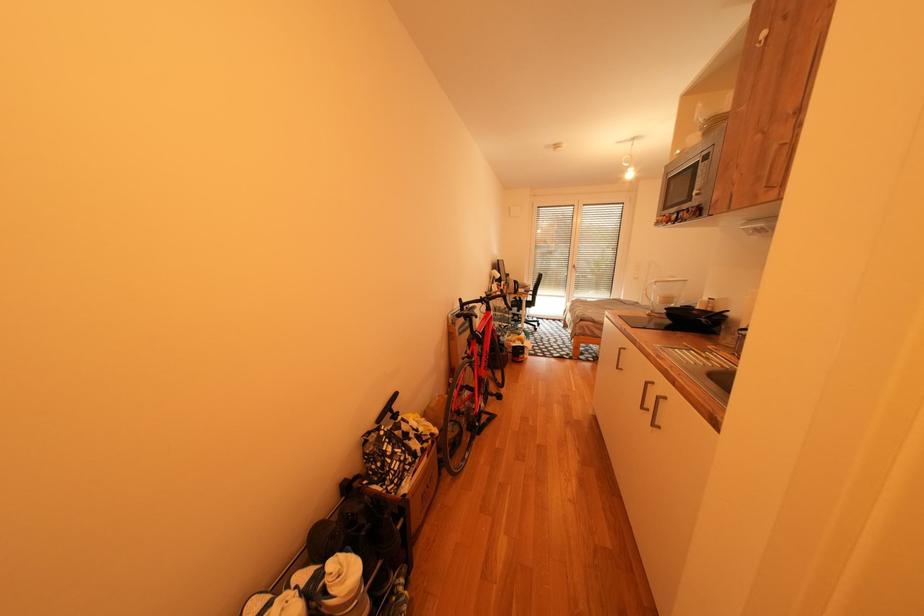
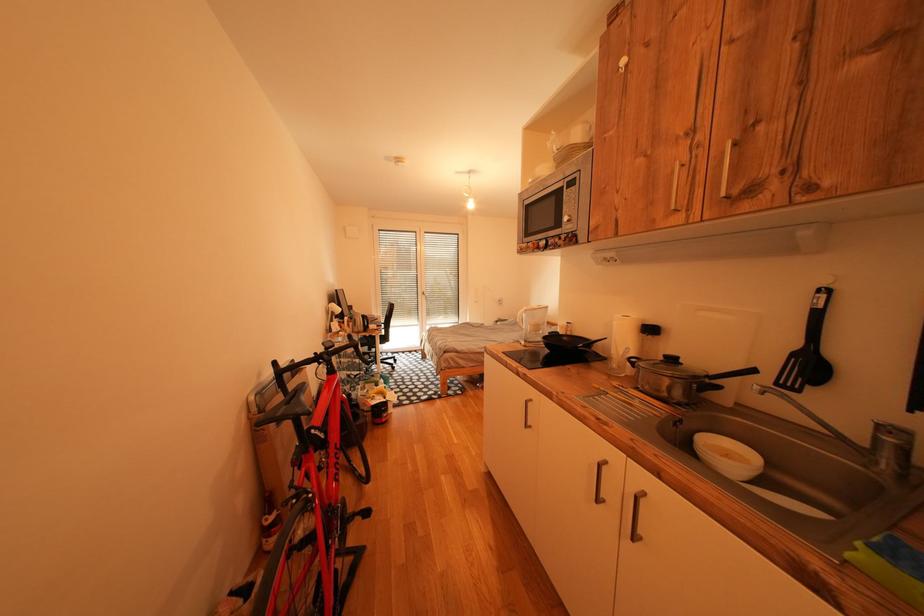
Question: Based on the continuous images, in which direction is the camera rotating? Reply with the corresponding letter.

Choices:
 (A) Left
 (B) Right
 (C) Up
 (D) Down

Answer: (B)